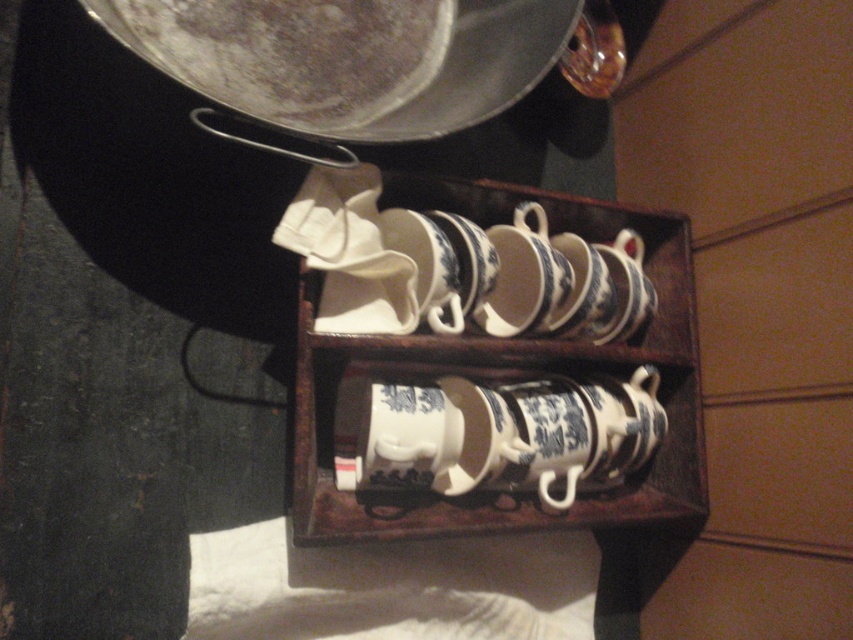
Consider the image. You are a chef preparing to place a new teacup on the shelf. You notice the shiny silver frying pan at upper center and the blue and white porcelain cups at center. Which object is nearer to you?

The shiny silver frying pan at upper center is closer to the viewer than the blue and white porcelain cups at center.

You are arranging items in a kitchen. You have a shiny silver frying pan at upper center and blue and white porcelain cups at center. If you want to place the frying pan closer to the cups, which direction should you move it?

The shiny silver frying pan at upper center is already to the left of the blue and white porcelain cups at center. To move it closer, you should move it to the right towards the cups.

You are a chef preparing to place a new teacup and saucer from the wooden box onto the shiny silver frying pan at upper center. The coordinates of the frying pan are given as point 0.092, 0.410. Can you confirm if the frying pan is positioned above the box?

The shiny silver frying pan at upper center is located at coordinates point (349, 58), which is above the wooden box. Therefore, the frying pan is positioned above the box.